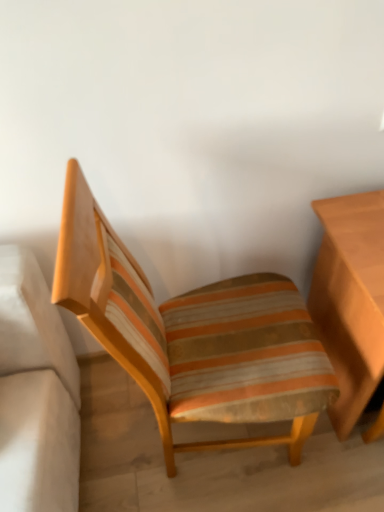
Question: Is light brown wooden table at right next to striped fabric chair at center and touching it?

Choices:
 (A) no
 (B) yes

Answer: (A)

Question: From the image's perspective, would you say light brown wooden table at right is positioned over striped fabric chair at center?

Choices:
 (A) no
 (B) yes

Answer: (B)

Question: Does light brown wooden table at right have a greater width compared to striped fabric chair at center?

Choices:
 (A) yes
 (B) no

Answer: (B)

Question: Does light brown wooden table at right appear on the right side of striped fabric chair at center?

Choices:
 (A) yes
 (B) no

Answer: (A)

Question: Is light brown wooden table at right smaller than striped fabric chair at center?

Choices:
 (A) yes
 (B) no

Answer: (A)

Question: Is light brown wooden table at right turned away from striped fabric chair at center?

Choices:
 (A) no
 (B) yes

Answer: (A)

Question: From the image's perspective, is striped fabric chair at center on light brown wooden table at right?

Choices:
 (A) no
 (B) yes

Answer: (A)

Question: Is striped fabric chair at center next to light brown wooden table at right and touching it?

Choices:
 (A) yes
 (B) no

Answer: (B)

Question: From a real-world perspective, is striped fabric chair at center on top of light brown wooden table at right?

Choices:
 (A) yes
 (B) no

Answer: (A)

Question: From a real-world perspective, does striped fabric chair at center sit lower than light brown wooden table at right?

Choices:
 (A) yes
 (B) no

Answer: (B)

Question: Is the position of striped fabric chair at center more distant than that of light brown wooden table at right?

Choices:
 (A) yes
 (B) no

Answer: (B)

Question: Considering the relative sizes of striped fabric chair at center and light brown wooden table at right in the image provided, is striped fabric chair at center bigger than light brown wooden table at right?

Choices:
 (A) yes
 (B) no

Answer: (A)

Question: From the image's perspective, is light brown wooden table at right positioned above or below striped fabric chair at center?

Choices:
 (A) below
 (B) above

Answer: (B)